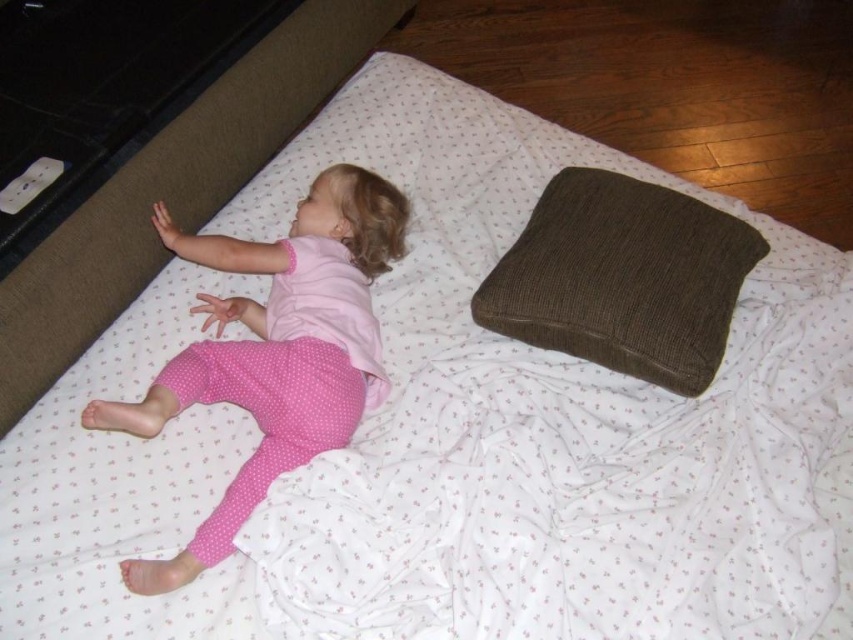
Question: Observing the image, what is the correct spatial positioning of pink polka dot pajamas at center in reference to brown corduroy pillow at upper right?

Choices:
 (A) above
 (B) below

Answer: (B)

Question: Which point is closer to the camera?

Choices:
 (A) pink polka dot pajamas at center
 (B) brown corduroy pillow at upper right

Answer: (A)

Question: Is pink polka dot pajamas at center positioned at the back of brown corduroy pillow at upper right?

Choices:
 (A) no
 (B) yes

Answer: (A)

Question: Does pink polka dot pajamas at center have a lesser width compared to brown corduroy pillow at upper right?

Choices:
 (A) no
 (B) yes

Answer: (B)

Question: Which of the following is the closest to the observer?

Choices:
 (A) pink polka dot pajamas at center
 (B) brown corduroy pillow at upper right

Answer: (A)